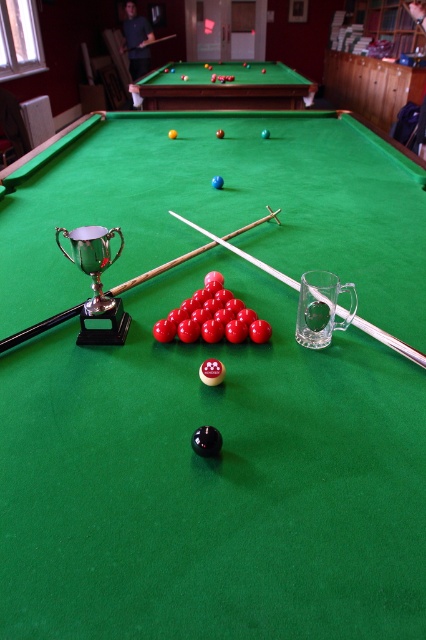
Is green felt pool table at upper center positioned at the back of clear wood cue at center?

Yes, it is.

Who is lower down, green felt pool table at upper center or clear wood cue at center?

clear wood cue at center

The width and height of the screenshot is (426, 640). Find the location of `green felt pool table at upper center`. green felt pool table at upper center is located at coordinates (222, 86).

Who is positioned more to the right, green felt billiard table at center or clear wood cue at center?

Positioned to the right is clear wood cue at center.

Does green felt billiard table at center appear on the left side of clear wood cue at center?

Yes, green felt billiard table at center is to the left of clear wood cue at center.

Who is more forward, [120,285] or [380,336]?

Point [380,336] is more forward.

The image size is (426, 640). Find the location of `green felt billiard table at center`. green felt billiard table at center is located at coordinates (199, 252).

From the picture: Is green felt billiard table at center wider than white wood cue at center?

No.

Does green felt billiard table at center have a lesser height compared to white wood cue at center?

No.

Between point (409, 154) and point (155, 275), which one is positioned behind?

Point (409, 154)

The image size is (426, 640). Identify the location of green felt billiard table at center. (199, 252).